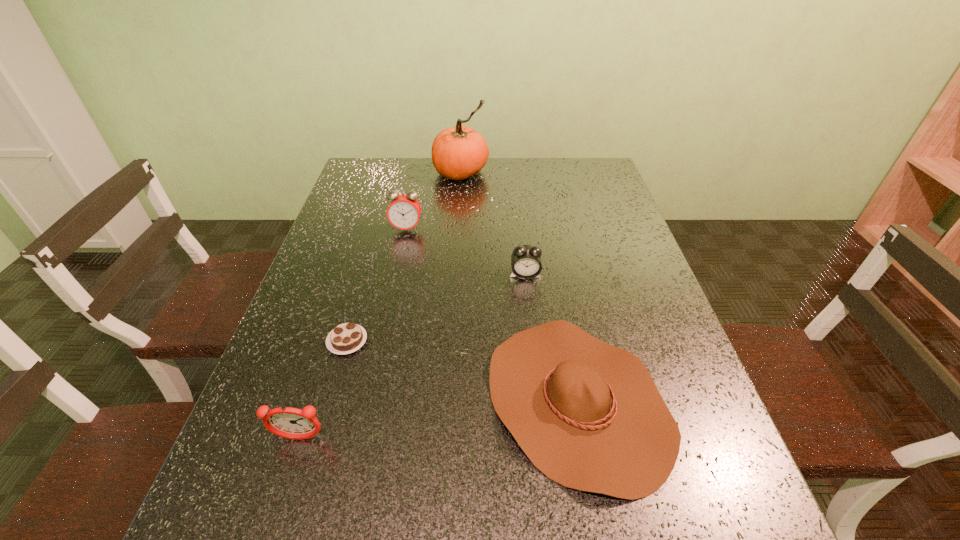
What are the coordinates of `vacant area situated 0.110m on the front-facing side of the farthest alarm clock` in the screenshot? It's located at (400, 260).

Where is `vacant space situated on the front-facing side of the nearest alarm clock`? vacant space situated on the front-facing side of the nearest alarm clock is located at coordinates (270, 532).

Identify the location of vacant area located 0.300m on the front side of the rightmost alarm clock. (538, 384).

Locate an element on the screen. The image size is (960, 540). free space located 0.340m on the back of the cowboy hat is located at coordinates (546, 235).

Locate an element on the screen. The height and width of the screenshot is (540, 960). vacant space located on the right of the shortest object is located at coordinates (442, 341).

At what (x,y) coordinates should I click in order to perform the action: click on object located at the far edge. Please return your answer as a coordinate pair (x, y). This screenshot has width=960, height=540. Looking at the image, I should click on (458, 153).

Identify the location of alarm clock positioned at the left edge. Image resolution: width=960 pixels, height=540 pixels. (287, 422).

Find the location of a particular element. The height and width of the screenshot is (540, 960). chocolate cake at the left edge is located at coordinates [346, 338].

This screenshot has height=540, width=960. Find the location of `object that is at the right edge`. object that is at the right edge is located at coordinates (588, 415).

Identify the location of vacant space at the far edge of the desktop. (552, 173).